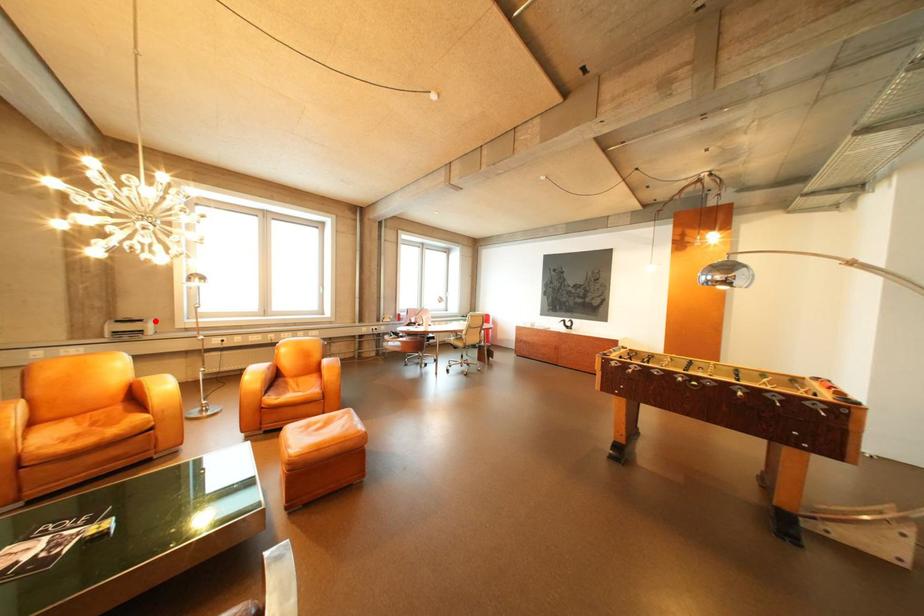
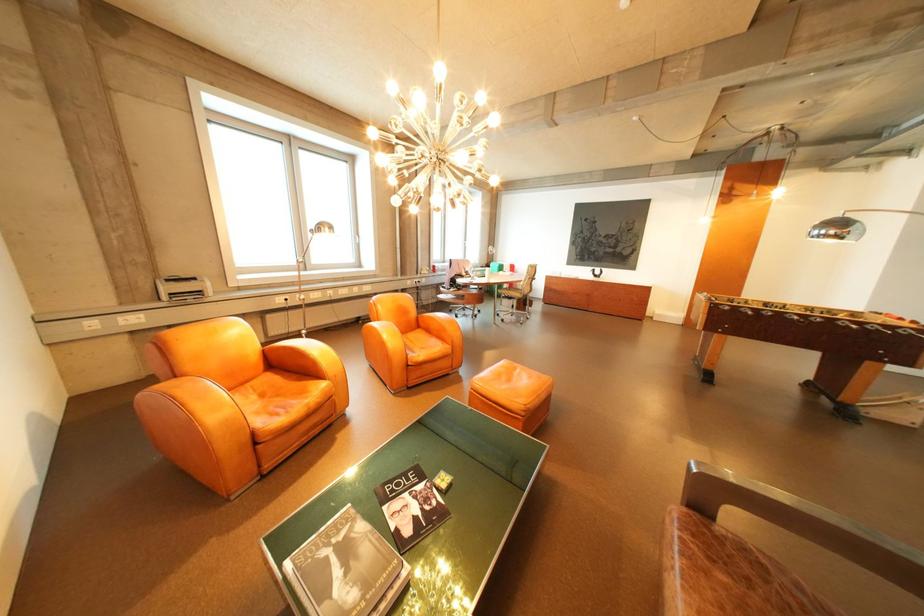
Question: A red point is marked in image1. In image2, is the corresponding 3D point closer to the camera or farther? Reply with the corresponding letter.

Choices:
 (A) The corresponding 3D point is closer.
 (B) The corresponding 3D point is farther.

Answer: (A)